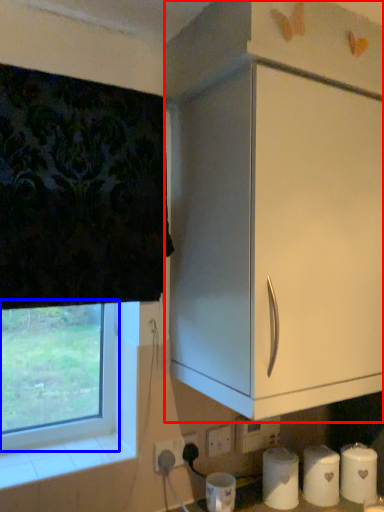
Question: Which point is closer to the camera, cabinetry (highlighted by a red box) or window (highlighted by a blue box)?

Choices:
 (A) cabinetry
 (B) window

Answer: (A)